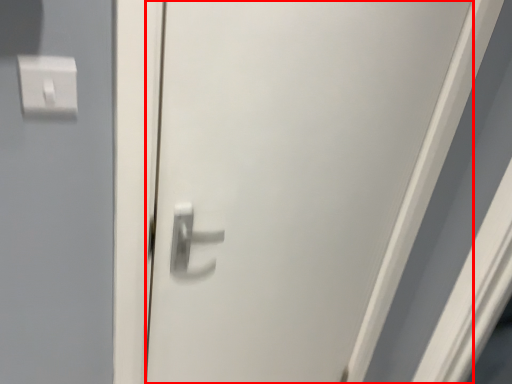
Question: From the image's perspective, where is door (annotated by the red box) located relative to light switch?

Choices:
 (A) below
 (B) above

Answer: (A)